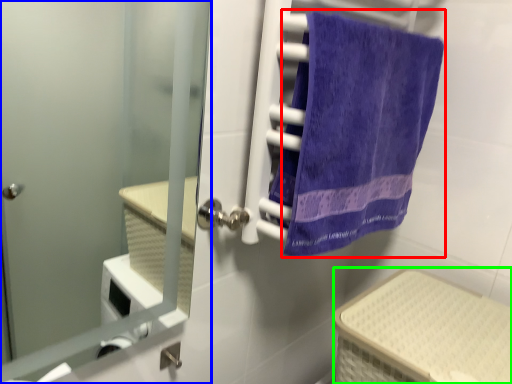
Question: Estimate the real-world distances between objects in this image. Which object is farther from towel (highlighted by a red box), door (highlighted by a blue box) or basket (highlighted by a green box)?

Choices:
 (A) door
 (B) basket

Answer: (A)